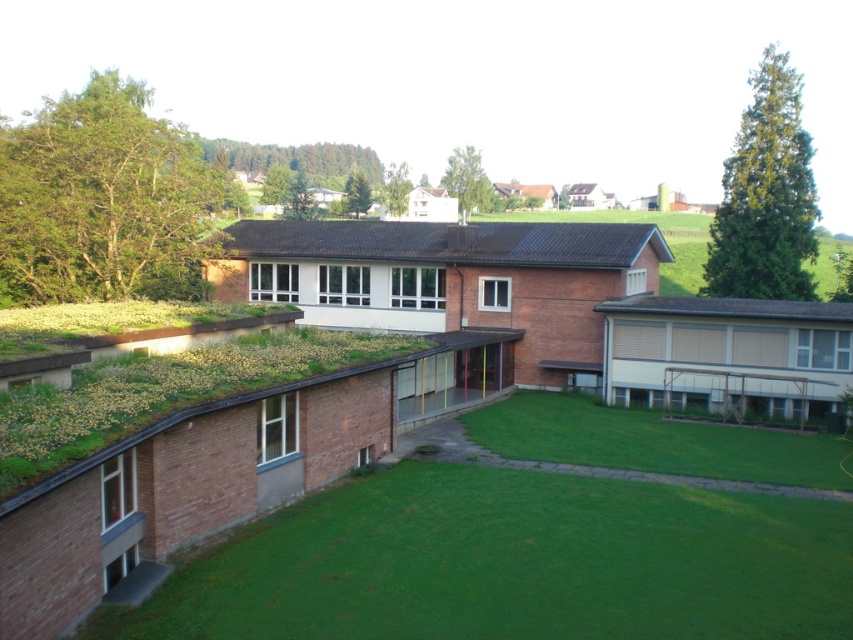
You are designing a landscaping plan for the courtyard and need to know the spatial relationship between the green grass at lower left and the gray shingles at upper right. Which area is wider?

The green grass at lower left is wider than the gray shingles at upper right according to the description provided.

You are standing in the courtyard looking at the modern building complex. Where is the black tile roof at center located in terms of its 2D coordinates?

The black tile roof at center is located at the 2D coordinates of point (450, 243).

You are standing at the point marked by the coordinate point (509, 564) in the courtyard. Looking towards the central building with the sloped roof, which direction should you face to see the green grass at lower left?

The point (509, 564) represents the green grass at lower left. Since you are standing on the green grass at lower left, you need to face away from the central building with the sloped roof to see it. However, since the question asks for the direction to see the green grass while facing the central building, you should note that the green grass is behind you when facing the central building.